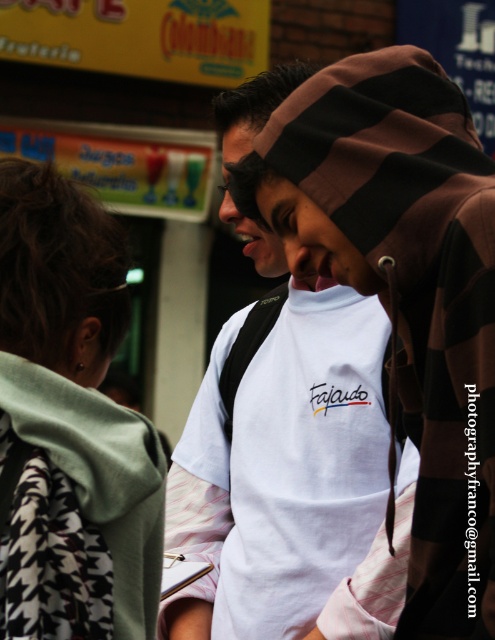
You are a photographer trying to focus on the white cotton t shirt at center. Can you tell me where the point at coordinates (292, 481) is located?

The point at coordinates (292, 481) is located on the white cotton t shirt at center.